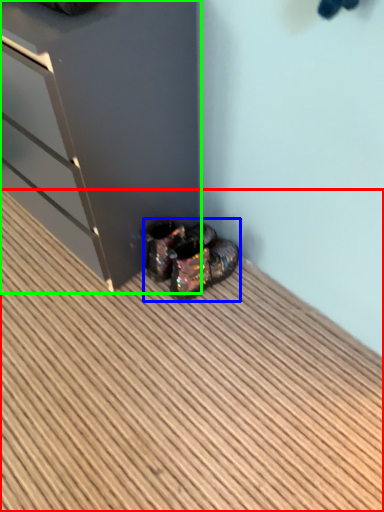
Question: Considering the real-world distances, which object is closest to hardwood (highlighted by a red box)? footwear (highlighted by a blue box) or dresser (highlighted by a green box).

Choices:
 (A) footwear
 (B) dresser

Answer: (A)